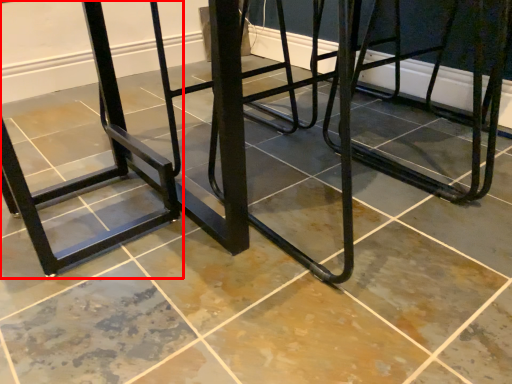
Question: In this image, where is bar stool (annotated by the red box) located relative to furniture?

Choices:
 (A) left
 (B) right

Answer: (A)